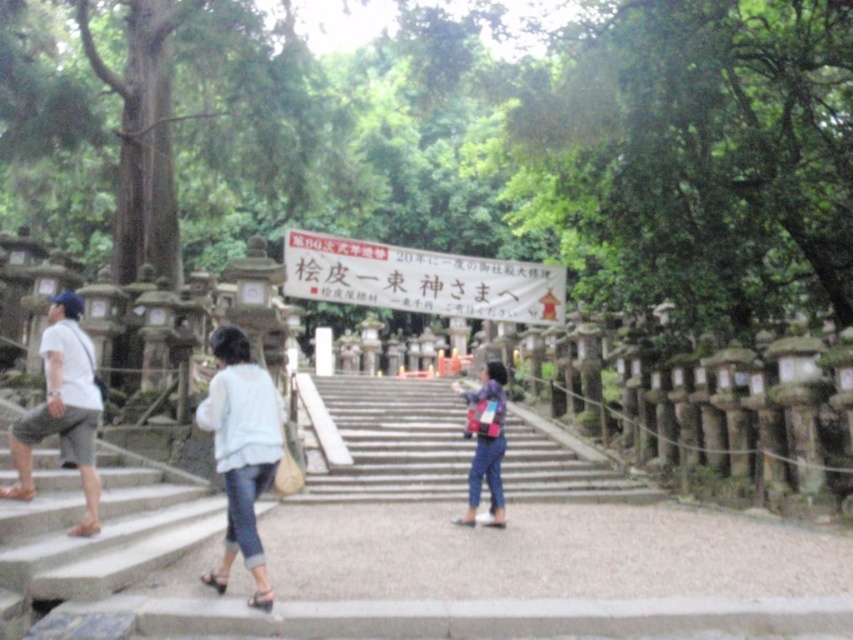
Is white cotton shirt at left wider than floral-patterned fabric bag at center?

Yes, white cotton shirt at left is wider than floral-patterned fabric bag at center.

Does white cotton shirt at left appear on the right side of floral-patterned fabric bag at center?

Incorrect, white cotton shirt at left is not on the right side of floral-patterned fabric bag at center.

I want to click on white cotton shirt at left, so click(62, 410).

Find the location of `white cotton shirt at left`. white cotton shirt at left is located at coordinates (62, 410).

Can you confirm if white paper sign at center is thinner than light blue denim jeans at lower left?

Incorrect, white paper sign at center's width is not less than light blue denim jeans at lower left's.

Measure the distance between white paper sign at center and camera.

white paper sign at center is 12.15 meters from camera.

The image size is (853, 640). I want to click on white paper sign at center, so click(x=421, y=280).

Is white paper sign at center to the right of floral-patterned fabric bag at center from the viewer's perspective?

Incorrect, white paper sign at center is not on the right side of floral-patterned fabric bag at center.

Does white paper sign at center appear under floral-patterned fabric bag at center?

No.

Identify the location of white paper sign at center. (421, 280).